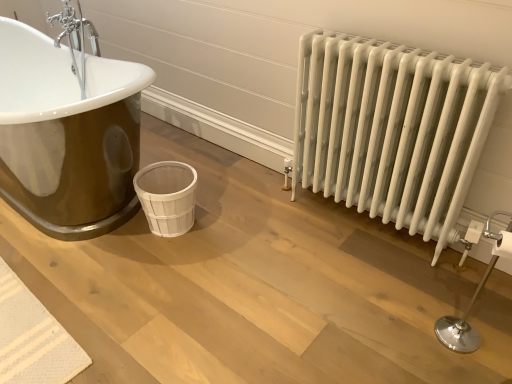
I want to click on free spot below white painted metal radiator at right (from a real-world perspective), so coord(372,227).